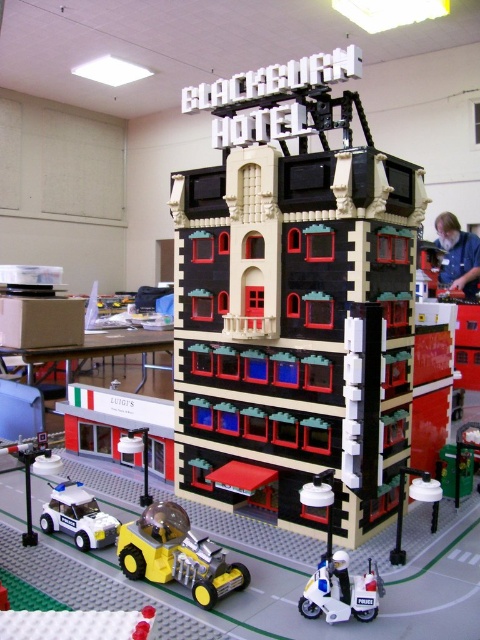
You are a delivery drone flying over the LEGO Blackburn Hotel scene. You need to drop a package at the brick patterned hotel at center. The coordinates for the brick patterned hotel at center are given as point (x=295, y=300). What are the coordinates you should target for the delivery?

The coordinates for the brick patterned hotel at center are point (x=295, y=300), so you should target those coordinates for the delivery.